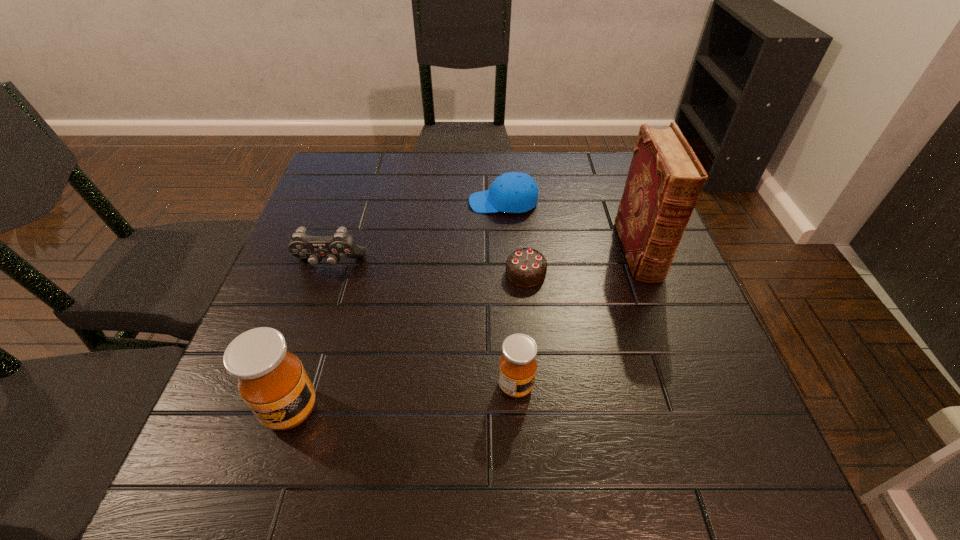
Given the evenly spaced honeys in the image, where should an extra honey be added on the right to preserve the spacing? Please point to a vacant space. Please provide its 2D coordinates. Your answer should be formatted as a tuple, i.e. [(x, y)], where the tuple contains the x and y coordinates of a point satisfying the conditions above.

[(723, 363)]